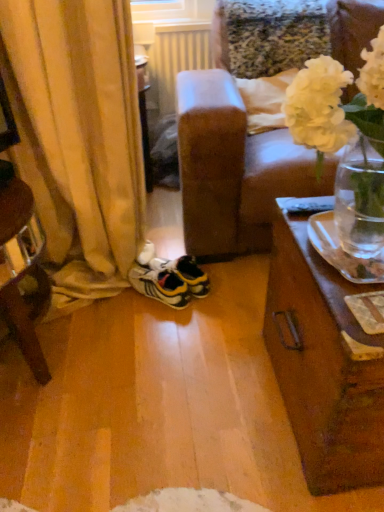
Question: Is the surface of yellow and white synthetic sneakers at center in direct contact with white plastic radiator at upper center?

Choices:
 (A) yes
 (B) no

Answer: (B)

Question: From a real-world perspective, is yellow and white synthetic sneakers at center positioned over white plastic radiator at upper center based on gravity?

Choices:
 (A) yes
 (B) no

Answer: (B)

Question: Can you confirm if yellow and white synthetic sneakers at center is smaller than white plastic radiator at upper center?

Choices:
 (A) yes
 (B) no

Answer: (A)

Question: Is yellow and white synthetic sneakers at center shorter than white plastic radiator at upper center?

Choices:
 (A) no
 (B) yes

Answer: (B)

Question: Can you confirm if yellow and white synthetic sneakers at center is taller than white plastic radiator at upper center?

Choices:
 (A) no
 (B) yes

Answer: (A)

Question: Is yellow and white synthetic sneakers at center at the left side of white plastic radiator at upper center?

Choices:
 (A) no
 (B) yes

Answer: (B)

Question: Considering the relative sizes of yellow and white synthetic sneakers at center and yellow fabric curtain at left in the image provided, is yellow and white synthetic sneakers at center shorter than yellow fabric curtain at left?

Choices:
 (A) yes
 (B) no

Answer: (A)

Question: From a real-world perspective, is yellow and white synthetic sneakers at center physically below yellow fabric curtain at left?

Choices:
 (A) no
 (B) yes

Answer: (B)

Question: Is yellow and white synthetic sneakers at center completely or partially outside of yellow fabric curtain at left?

Choices:
 (A) yes
 (B) no

Answer: (B)

Question: Considering the relative sizes of yellow and white synthetic sneakers at center and yellow fabric curtain at left in the image provided, is yellow and white synthetic sneakers at center bigger than yellow fabric curtain at left?

Choices:
 (A) no
 (B) yes

Answer: (A)

Question: Does yellow and white synthetic sneakers at center contain yellow fabric curtain at left?

Choices:
 (A) yes
 (B) no

Answer: (B)

Question: Is yellow and white synthetic sneakers at center at the right side of yellow fabric curtain at left?

Choices:
 (A) no
 (B) yes

Answer: (B)

Question: Are white matte vase at upper right and white plastic radiator at upper center far apart?

Choices:
 (A) yes
 (B) no

Answer: (A)